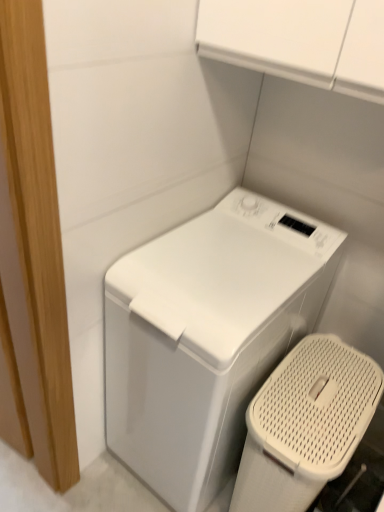
What are the coordinates of `vacant space situated above white mesh laundry basket at lower right (from a real-world perspective)` in the screenshot? It's located at (326, 390).